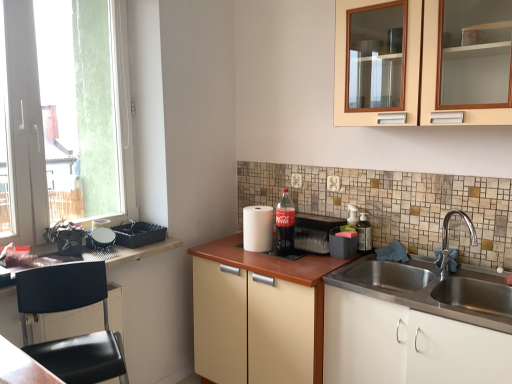
Identify the location of free space in front of coca-cola bottle at center, the 1th bottle positioned from the left. The image size is (512, 384). (287, 264).